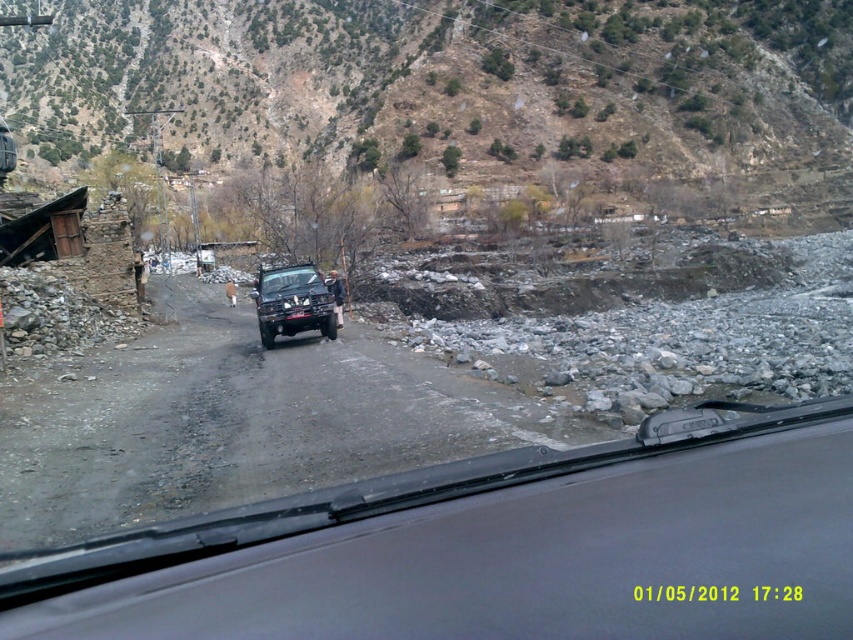
Question: Which of the following is the closest to the observer?

Choices:
 (A) shiny black jeep at center
 (B) brown rocky hillside at upper center
 (C) black rubber windshield at center

Answer: (C)

Question: In this image, where is black rubber windshield at center located relative to shiny black jeep at center?

Choices:
 (A) below
 (B) above

Answer: (A)

Question: Can you confirm if black rubber windshield at center is smaller than shiny black jeep at center?

Choices:
 (A) yes
 (B) no

Answer: (A)

Question: Is brown rocky hillside at upper center wider than shiny black jeep at center?

Choices:
 (A) yes
 (B) no

Answer: (A)

Question: Based on their relative distances, which object is farther from the black rubber windshield at center?

Choices:
 (A) brown rocky hillside at upper center
 (B) shiny black jeep at center

Answer: (A)

Question: Considering the real-world distances, which object is closest to the shiny black jeep at center?

Choices:
 (A) black rubber windshield at center
 (B) brown rocky hillside at upper center

Answer: (A)